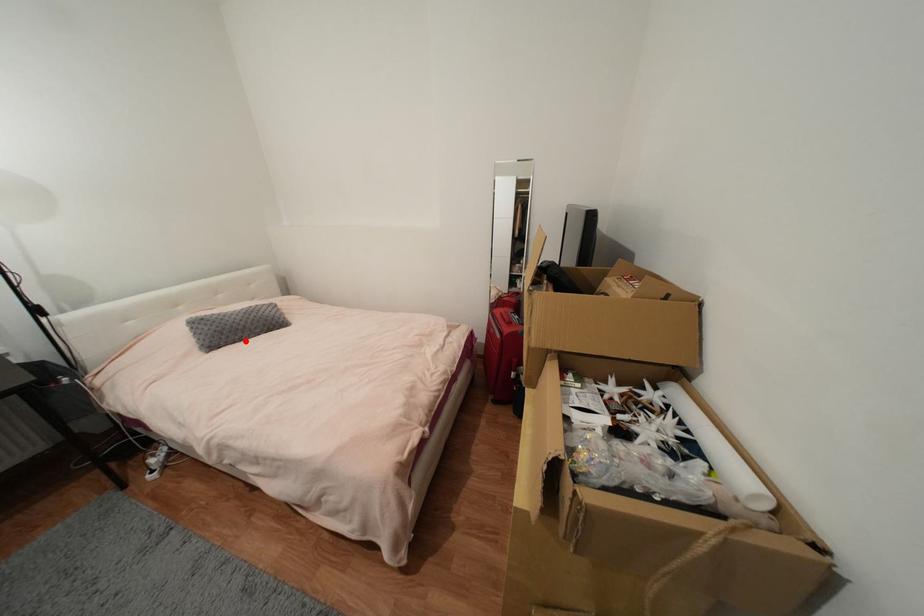
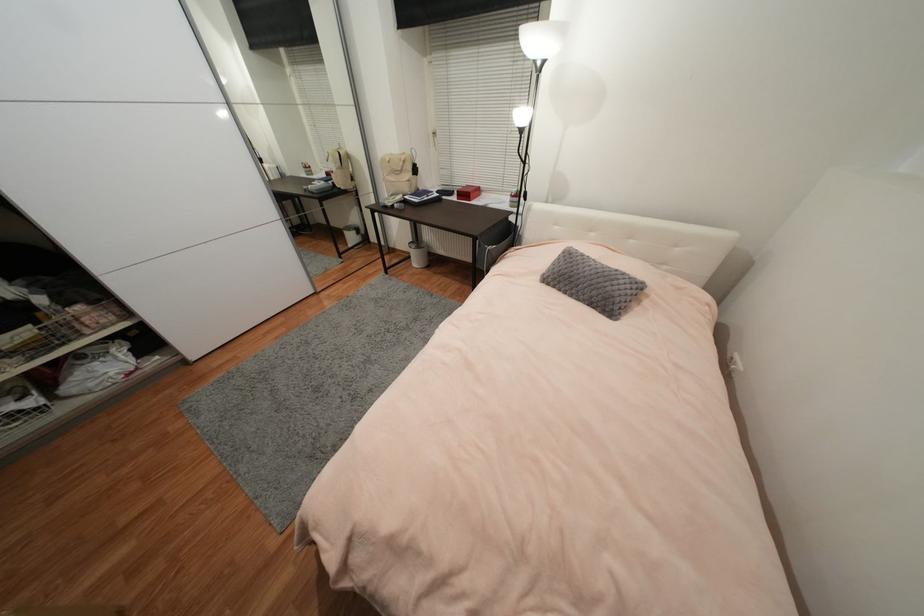
Locate, in the second image, the point that corresponds to the highlighted location in the first image.

(569, 294)